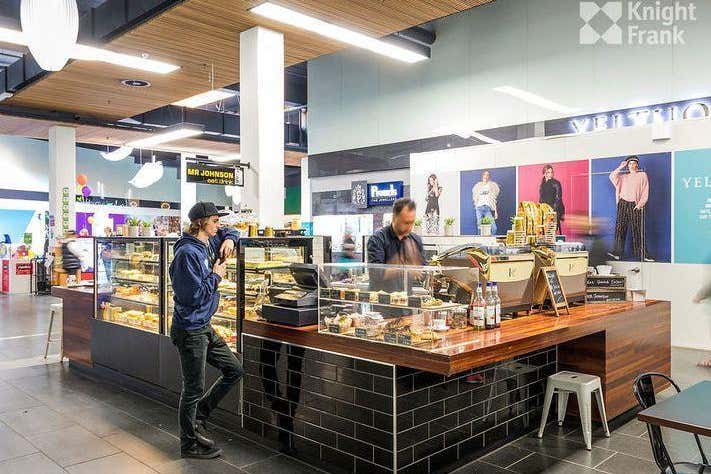
Image resolution: width=711 pixels, height=474 pixels. Identify the location of employee behind counter. (402, 248).